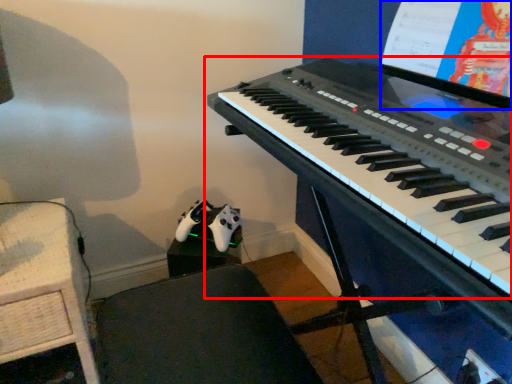
Question: Which object is closer to the camera taking this photo, musical keyboard (highlighted by a red box) or computer screen (highlighted by a blue box)?

Choices:
 (A) musical keyboard
 (B) computer screen

Answer: (A)